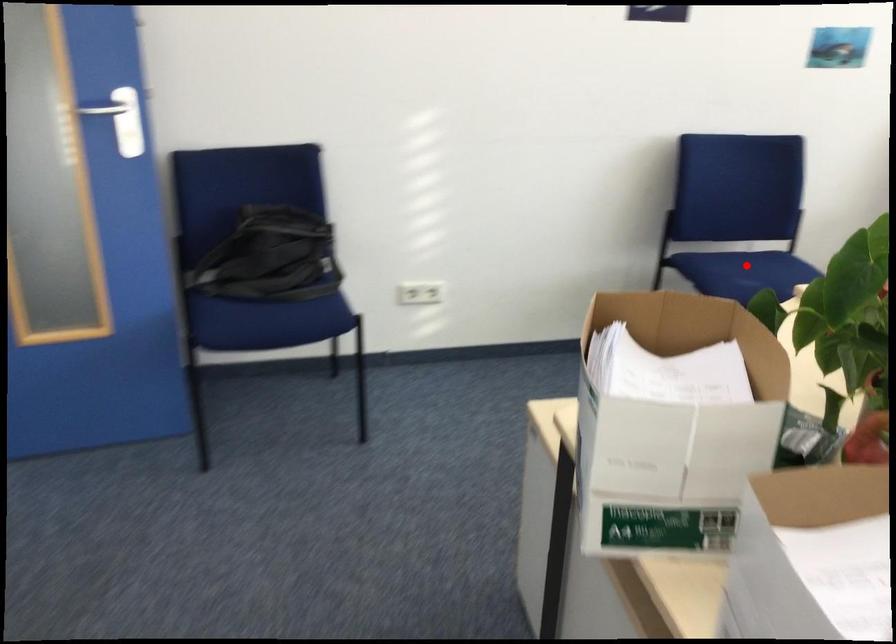
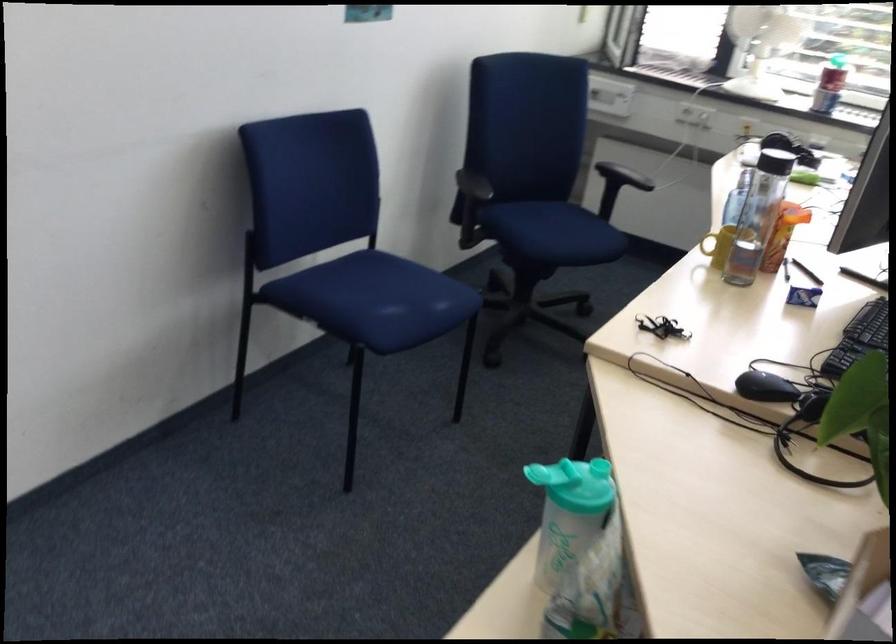
Question: I am providing you with two images of the same scene from different viewpoints. In image1, a red point is highlighted. Considering the same 3D point in image2, which of the following is correct?

Choices:
 (A) It is closer
 (B) It is farther

Answer: (A)